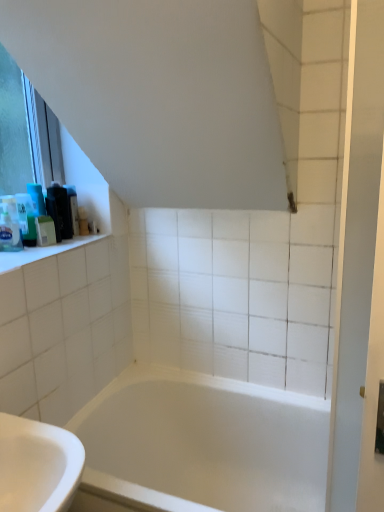
Question: Is matte black soap dispenser at upper left, the 5th toiletry in the front-to-back sequence, situated inside white glossy screen door at right or outside?

Choices:
 (A) outside
 (B) inside

Answer: (A)

Question: Is point (74, 189) positioned closer to the camera than point (334, 426)?

Choices:
 (A) farther
 (B) closer

Answer: (A)

Question: Which of these objects is positioned closest to the green matte soap at left, the 2th toiletry when ordered from front to back?

Choices:
 (A) black plastic container at upper left, marked as the 4th toiletry in a front-to-back arrangement
 (B) white glossy screen door at right
 (C) translucent plastic soap at upper left, the fifth toiletry when ordered from back to front
 (D) matte black soap dispenser at upper left, the 5th toiletry in the front-to-back sequence
 (E) translucent plastic bottle at left, the third toiletry positioned from the front

Answer: (E)

Question: Estimate the real-world distances between objects in this image. Which object is closer to the white glossy bathtub at center?

Choices:
 (A) white glossy screen door at right
 (B) matte black soap dispenser at upper left, the 5th toiletry in the front-to-back sequence
 (C) translucent plastic soap at upper left, which ranks as the first toiletry in front-to-back order
 (D) green matte soap at left, the 2th toiletry when ordered from front to back
 (E) translucent plastic bottle at left, the third toiletry positioned from the front

Answer: (A)